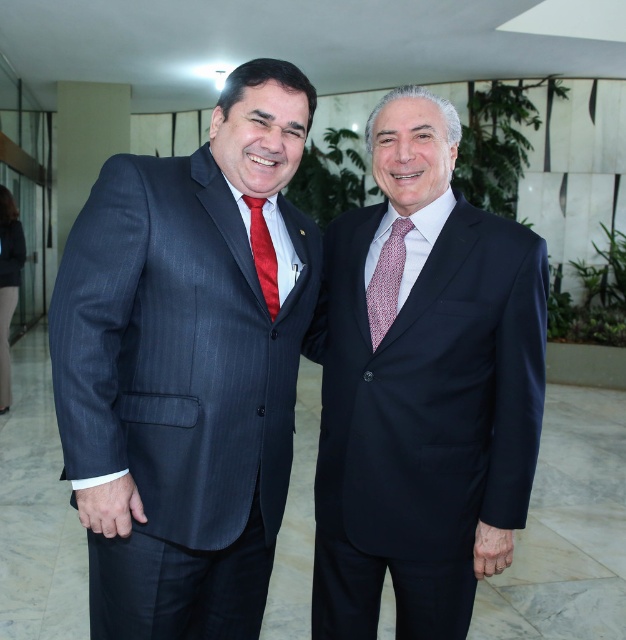
Between matte black suit at center and red textured tie at center, which one has less height?

Standing shorter between the two is red textured tie at center.

Find the location of a particular element. The width and height of the screenshot is (626, 640). matte black suit at center is located at coordinates (421, 387).

The image size is (626, 640). In order to click on matte black suit at center in this screenshot , I will do `click(421, 387)`.

Does pinstriped suit at left have a lesser height compared to matte red tie at center?

No, pinstriped suit at left is not shorter than matte red tie at center.

Which is below, pinstriped suit at left or matte red tie at center?

pinstriped suit at left

Identify the location of pinstriped suit at left. This screenshot has height=640, width=626. (185, 368).

Which is behind, point (535, 244) or point (264, 252)?

The point (535, 244) is more distant.

Where is `matte black suit at center`? This screenshot has width=626, height=640. matte black suit at center is located at coordinates (421, 387).

I want to click on matte black suit at center, so click(421, 387).